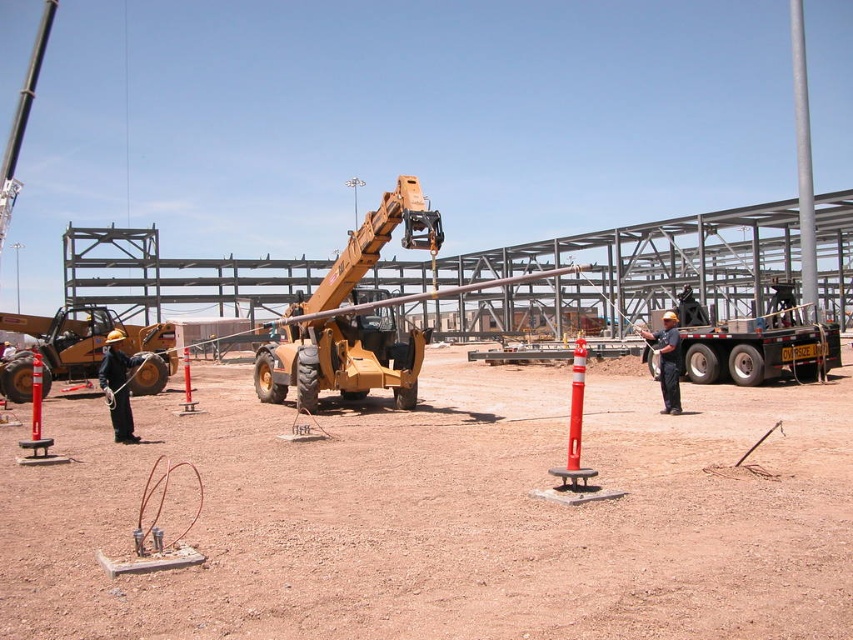
In the scene shown: You are a construction worker planning to park your new vehicle next to the metallic trailer truck at center and the matte black hard hat at left. Since you need to know the space requirements, can you determine which object takes up more horizontal space?

The matte black hard hat at left takes up more horizontal space since the metallic trailer truck at center has a lesser width compared to matte black hard hat at left.

You are a safety inspector at the construction site. You notice a matte black hard hat at left and a metallic trailer truck at center. Which object is closer to the front of the scene?

The metallic trailer truck at center is closer to the front of the scene because the matte black hard hat at left is positioned behind it.